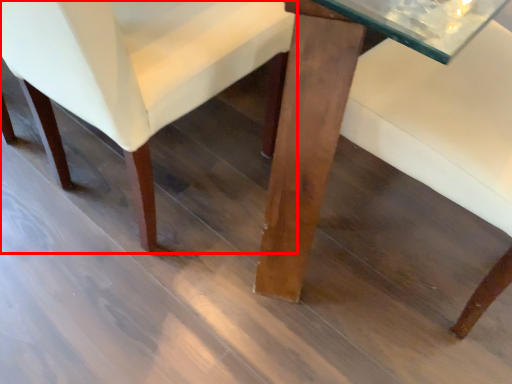
Question: From the image's perspective, what is the correct spatial positioning of chair (annotated by the red box) in reference to table?

Choices:
 (A) above
 (B) below

Answer: (A)